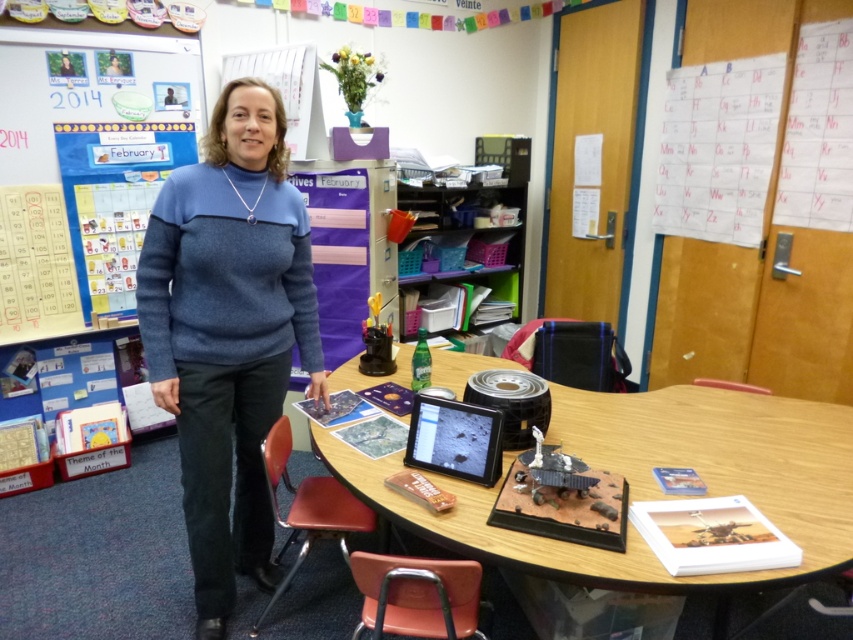
You are a student entering the classroom and see the wooden table at center and the whiteboard at upper left. Which object is located to the left side of the other?

The wooden table at center is to the right of the whiteboard at upper left, so the whiteboard at upper left is located to the left side of the wooden table at center.

You are a student entering the classroom and see the blue wool sweater at center and the wooden table at center. Which object is closer to you?

The blue wool sweater at center is closer to you because it is in front of the wooden table at center.